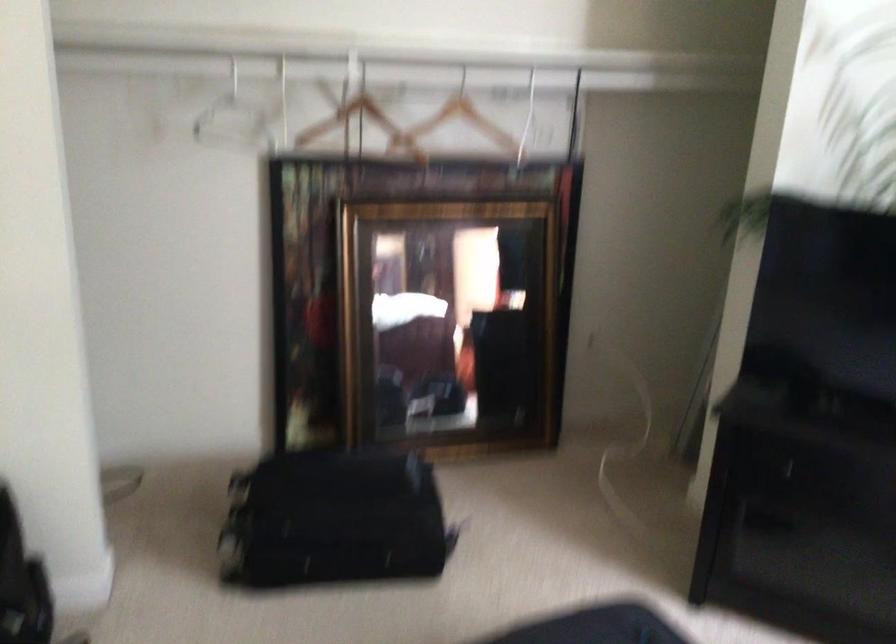
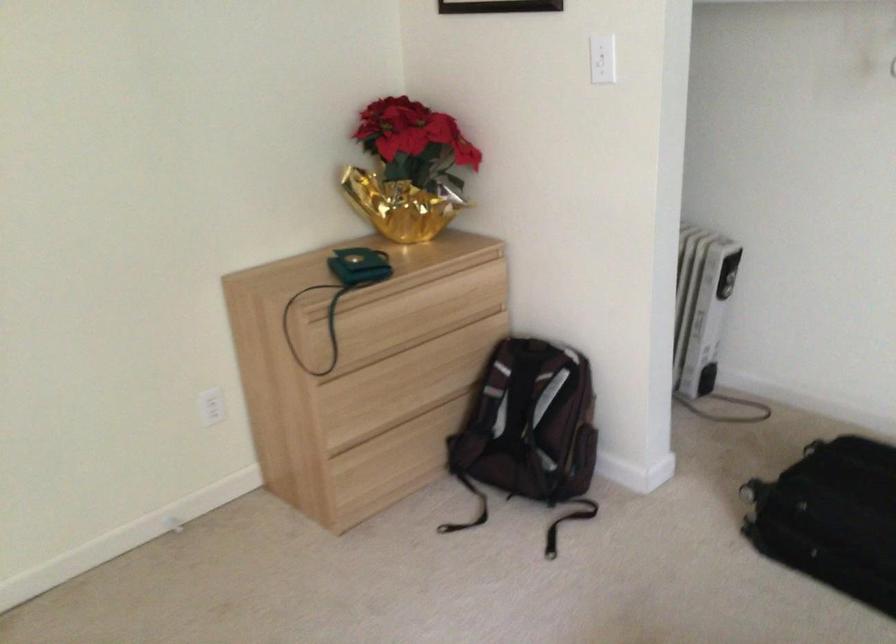
Where in the second image is the point corresponding to (x=328, y=525) from the first image?

(831, 518)